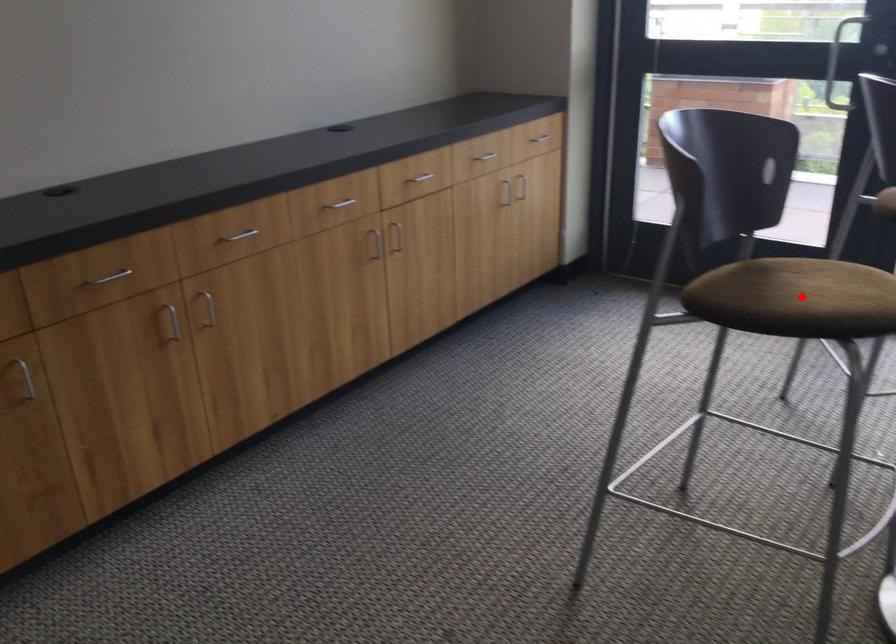
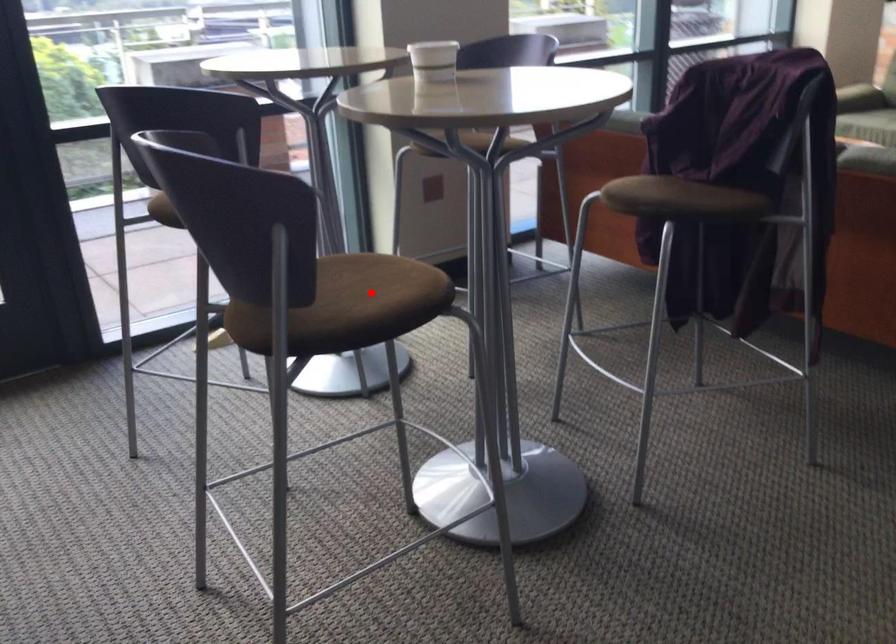
I am providing you with two images of the same scene from different viewpoints. A red point is marked on the first image and another point is marked on the second image. Are the points marked in image1 and image2 representing the same 3D position?

Yes